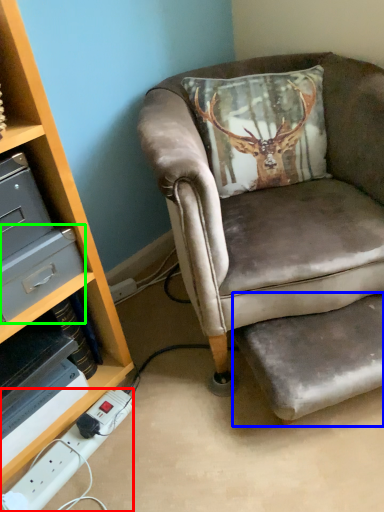
Question: Estimate the real-world distances between objects in this image. Which object is farther from power outlet (highlighted by a red box), footrest (highlighted by a blue box) or drawer (highlighted by a green box)?

Choices:
 (A) footrest
 (B) drawer

Answer: (A)